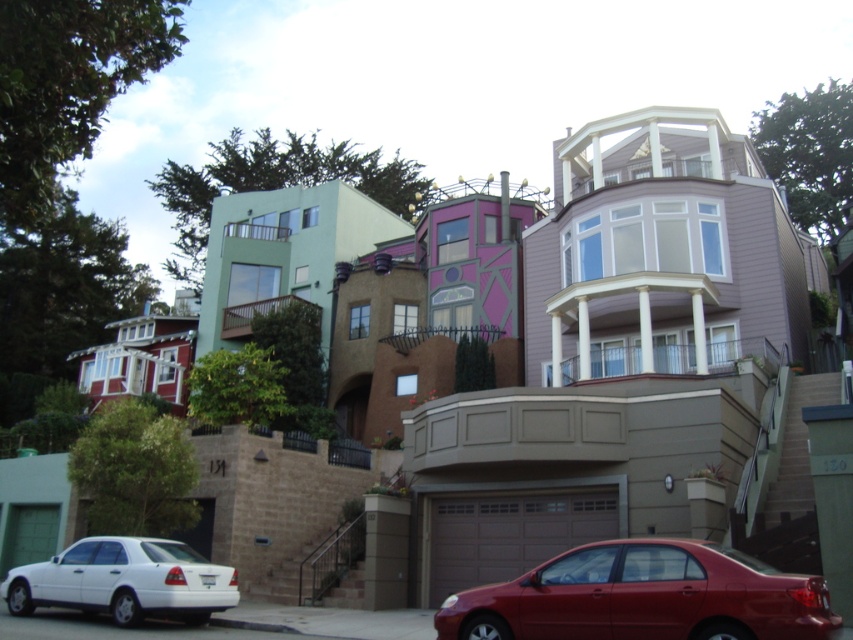
Consider the image. You are a delivery driver approaching the residential area shown in the image. You need to park your vehicle, which is the same size as the shiny red sedan at lower center. There is a parking spot available where the matte white sedan at lower left is currently parked. Can your vehicle fit in that spot?

The shiny red sedan at lower center is located above the matte white sedan at lower left. Since the parking spot for the matte white sedan at lower left is below the shiny red sedan at lower center, your vehicle can fit in that spot as it is the same size and the location is suitable for parking.

From the picture: You are a delivery driver trying to park your truck, which is 2 meters tall, in the driveway between the shiny red sedan at lower center and the matte white sedan at lower left. Can your truck fit through the space between them?

The shiny red sedan at lower center is much taller than the matte white sedan at lower left. Since the truck is 2 meters tall, it depends on the height of the lower sedan. However, the description only states the relative height between the two sedans, not their absolute heights. Without knowing the exact height of the matte white sedan, it is impossible to determine if the truck can fit.

Consider the image. You are a delivery driver who needs to park your shiny red sedan at lower center at point (643, 596). However, there is a house painted in light green hue with red lower section to the left of this point. Can you safely park your vehicle there without blocking the driveway of the light green house?

The shiny red sedan at lower center can be parked at point (643, 596) safely as it is located at the lower center, away from the driveway of the light green house with red lower section to the left.